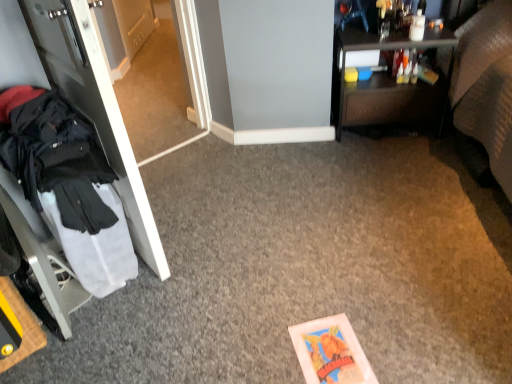
Image resolution: width=512 pixels, height=384 pixels. What do you see at coordinates (391, 81) in the screenshot?
I see `dark brown wood desk at upper right` at bounding box center [391, 81].

Locate an element on the screen. This screenshot has width=512, height=384. black fabric coat at left is located at coordinates (x=68, y=183).

From the image's perspective, is black fabric coat at left located above transparent glass door at left?

Actually, black fabric coat at left appears below transparent glass door at left in the image.

Where is `clothing on the left of the transparent glass door at left`? The width and height of the screenshot is (512, 384). clothing on the left of the transparent glass door at left is located at coordinates (68, 183).

From a real-world perspective, is black fabric coat at left physically located above or below transparent glass door at left?

In terms of real-world spatial position, black fabric coat at left is above transparent glass door at left.

The image size is (512, 384). Find the location of `clothing that is below the white glossy door at left (from the image's perspective)`. clothing that is below the white glossy door at left (from the image's perspective) is located at coordinates (68, 183).

Is white glossy door at left not near black fabric coat at left?

No, white glossy door at left is not far from black fabric coat at left.

Is black fabric coat at left inside white glossy door at left?

No, white glossy door at left does not contain black fabric coat at left.

From a real-world perspective, who is located lower, white glossy door at left or black fabric coat at left?

From a 3D spatial view, white glossy door at left is below.

Which object is further away from the camera, black fabric coat at left or white glossy door at left?

black fabric coat at left is further away from the camera.

Is black fabric coat at left touching white glossy door at left?

black fabric coat at left and white glossy door at left are not in contact.

Considering the relative positions of black fabric coat at left and white glossy door at left in the image provided, is black fabric coat at left to the right of white glossy door at left from the viewer's perspective?

No.

From the image's perspective, is transparent glass door at left on dark brown wood desk at upper right?

Yes.

Is point (137, 91) positioned behind point (336, 126)?

Yes, it is behind point (336, 126).

Is transparent glass door at left looking in the opposite direction of dark brown wood desk at upper right?

That's not correct — transparent glass door at left is not looking away from dark brown wood desk at upper right.

Can black fabric coat at left be found inside dark brown wood desk at upper right?

Actually, black fabric coat at left is outside dark brown wood desk at upper right.

Can you confirm if dark brown wood desk at upper right is smaller than black fabric coat at left?

Incorrect, dark brown wood desk at upper right is not smaller in size than black fabric coat at left.

Is dark brown wood desk at upper right to the left of black fabric coat at left from the viewer's perspective?

Incorrect, dark brown wood desk at upper right is not on the left side of black fabric coat at left.

Between dark brown wood desk at upper right and black fabric coat at left, which one is positioned behind?

Positioned behind is dark brown wood desk at upper right.

Measure the distance between black fabric coat at left and dark brown wood desk at upper right.

4.98 feet.

Based on the photo, is black fabric coat at left oriented towards dark brown wood desk at upper right?

No, black fabric coat at left is not facing towards dark brown wood desk at upper right.

Looking at this image, is black fabric coat at left touching dark brown wood desk at upper right?

No, black fabric coat at left is not making contact with dark brown wood desk at upper right.

Which is behind, point (96, 281) or point (359, 52)?

The point (359, 52) is farther from the camera.

Are transparent glass door at left and white glossy door at left located far from each other?

transparent glass door at left is far away from white glossy door at left.

Considering the positions of objects transparent glass door at left and white glossy door at left in the image provided, who is in front, transparent glass door at left or white glossy door at left?

Positioned in front is white glossy door at left.

Considering the sizes of transparent glass door at left and white glossy door at left in the image, is transparent glass door at left taller or shorter than white glossy door at left?

In the image, transparent glass door at left appears to be shorter than white glossy door at left.

Based on the photo, from a real-world perspective, is transparent glass door at left positioned above or below white glossy door at left?

In terms of real-world spatial position, transparent glass door at left is below white glossy door at left.

Find the location of a particular element. This screenshot has width=512, height=384. glass door lying behind the black fabric coat at left is located at coordinates pos(164,94).

Locate an element on the screen. The width and height of the screenshot is (512, 384). clothing lying below the white glossy door at left (from the image's perspective) is located at coordinates (68, 183).

Looking at the image, which one is located further to dark brown wood desk at upper right, white glossy door at left or transparent glass door at left?

Among the two, white glossy door at left is located further to dark brown wood desk at upper right.

Estimate the real-world distances between objects in this image. Which object is closer to black fabric coat at left, transparent glass door at left or white glossy door at left?

Based on the image, white glossy door at left appears to be nearer to black fabric coat at left.

Estimate the real-world distances between objects in this image. Which object is further from white glossy door at left, dark brown wood desk at upper right or black fabric coat at left?

Among the two, dark brown wood desk at upper right is located further to white glossy door at left.

Which object lies further to the anchor point black fabric coat at left, dark brown wood desk at upper right or transparent glass door at left?

Among the two, dark brown wood desk at upper right is located further to black fabric coat at left.

When comparing their distances from transparent glass door at left, does black fabric coat at left or dark brown wood desk at upper right seem closer?

dark brown wood desk at upper right lies closer to transparent glass door at left than the other object.

From the image, which object appears to be farther from white glossy door at left, black fabric coat at left or transparent glass door at left?

The object further to white glossy door at left is transparent glass door at left.

Consider the image. Based on their spatial positions, is black fabric coat at left or dark brown wood desk at upper right closer to white glossy door at left?

Among the two, black fabric coat at left is located nearer to white glossy door at left.

From the image, which object appears to be nearer to black fabric coat at left, dark brown wood desk at upper right or white glossy door at left?

Among the two, white glossy door at left is located nearer to black fabric coat at left.

Locate an element on the screen. glass door between white glossy door at left and dark brown wood desk at upper right from left to right is located at coordinates (164, 94).

Locate an element on the screen. This screenshot has width=512, height=384. clothing between white glossy door at left and transparent glass door at left in the front-back direction is located at coordinates (68, 183).

This screenshot has height=384, width=512. I want to click on door situated between black fabric coat at left and dark brown wood desk at upper right from left to right, so click(x=95, y=108).

The width and height of the screenshot is (512, 384). What are the coordinates of `glass door between black fabric coat at left and dark brown wood desk at upper right` in the screenshot? It's located at (164, 94).